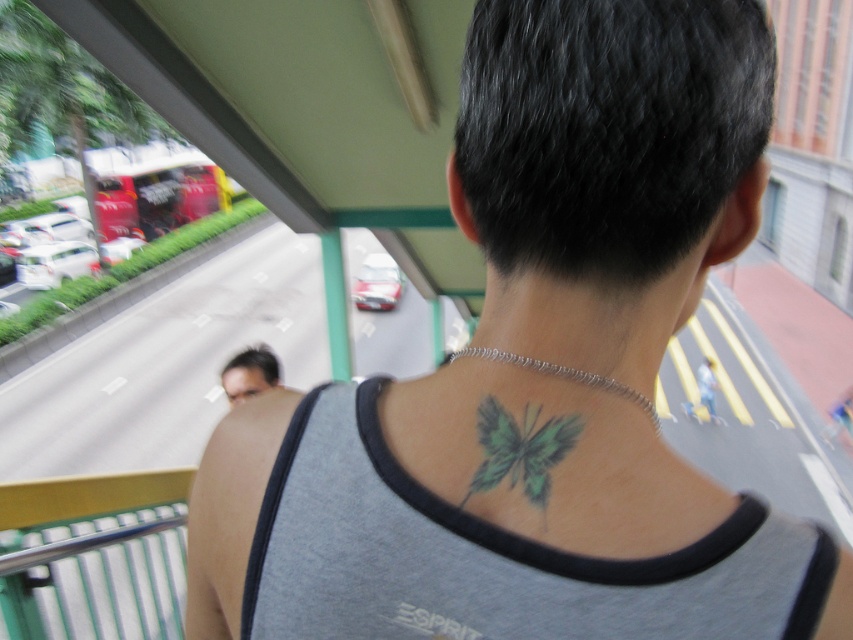
You are a photographer trying to capture both the green tattoo at center and the green matte butterfly at upper center in a single shot. Given that the camera has a fixed focal length, which object should you focus on to ensure both are in frame without cropping?

Since the green tattoo at center is bigger than the green matte butterfly at upper center, you should focus on the green tattoo at center to ensure both are in frame without cropping.

You are a photographer trying to capture a clear shot of both the green tattoo at center and the green matte butterfly at upper center from this vantage point. Which object will appear larger in your photo?

The green tattoo at center will appear much larger in the photo since it is described as much taller than the green matte butterfly at upper center.